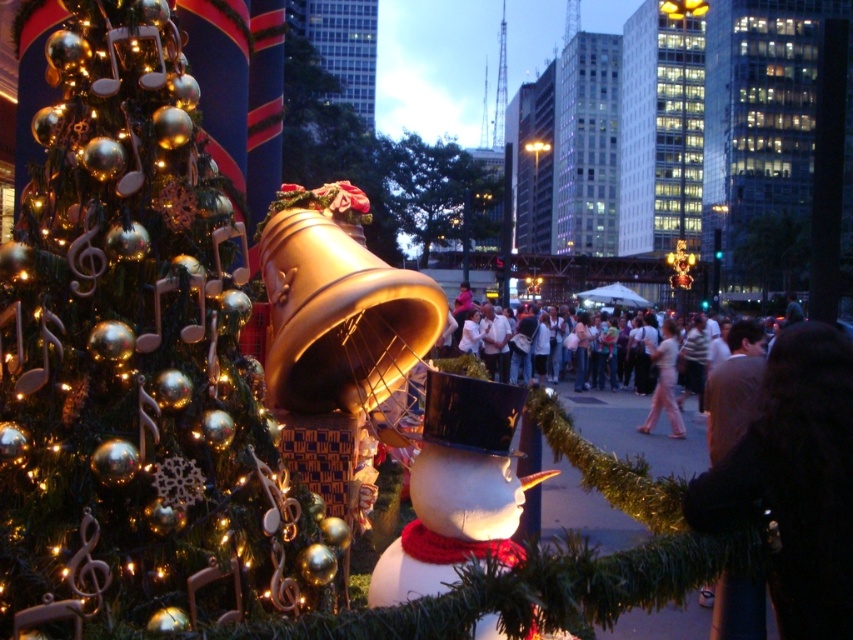
Question: Which object is positioned closest to the pink fabric pants at center?

Choices:
 (A) white matte snowman at center
 (B) shiny gold ornaments at left

Answer: (A)

Question: Can you confirm if shiny gold ornaments at left is thinner than white matte snowman at center?

Choices:
 (A) yes
 (B) no

Answer: (B)

Question: Among these objects, which one is farthest from the camera?

Choices:
 (A) pink fabric pants at center
 (B) white matte snowman at center
 (C) shiny gold ornaments at left

Answer: (A)

Question: Can you confirm if shiny gold ornaments at left is positioned to the left of pink fabric pants at center?

Choices:
 (A) no
 (B) yes

Answer: (B)

Question: Which object appears farthest from the camera in this image?

Choices:
 (A) pink fabric pants at center
 (B) shiny gold ornaments at left
 (C) white matte snowman at center

Answer: (A)

Question: Does shiny gold ornaments at left come behind white matte snowman at center?

Choices:
 (A) no
 (B) yes

Answer: (A)